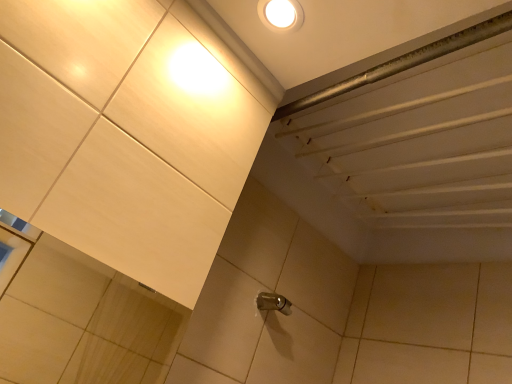
Question: Is white glossy droplight at upper center wider or thinner than satin nickel faucet at center?

Choices:
 (A) wide
 (B) thin

Answer: (A)

Question: Would you say white glossy droplight at upper center is to the left or to the right of satin nickel faucet at center in the picture?

Choices:
 (A) left
 (B) right

Answer: (A)

Question: From a real-world perspective, relative to satin nickel faucet at center, is white glossy droplight at upper center vertically above or below?

Choices:
 (A) below
 (B) above

Answer: (B)

Question: Would you say satin nickel faucet at center is to the left or to the right of white glossy droplight at upper center in the picture?

Choices:
 (A) right
 (B) left

Answer: (A)

Question: From the image's perspective, is satin nickel faucet at center positioned above or below white glossy droplight at upper center?

Choices:
 (A) above
 (B) below

Answer: (B)

Question: Considering their positions, is satin nickel faucet at center located in front of or behind white glossy droplight at upper center?

Choices:
 (A) front
 (B) behind

Answer: (B)

Question: In terms of height, does satin nickel faucet at center look taller or shorter compared to white glossy droplight at upper center?

Choices:
 (A) short
 (B) tall

Answer: (B)